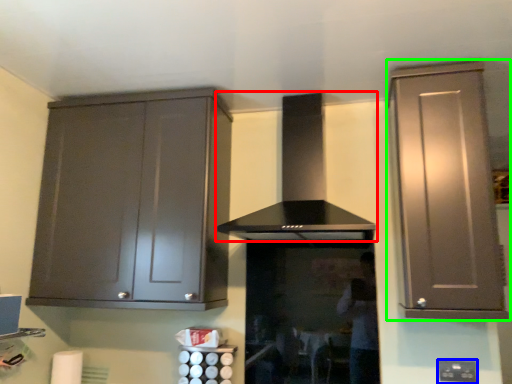
Question: Estimate the real-world distances between objects in this image. Which object is closer to home appliance (highlighted by a red box), electric outlet (highlighted by a blue box) or cabinetry (highlighted by a green box)?

Choices:
 (A) electric outlet
 (B) cabinetry

Answer: (B)